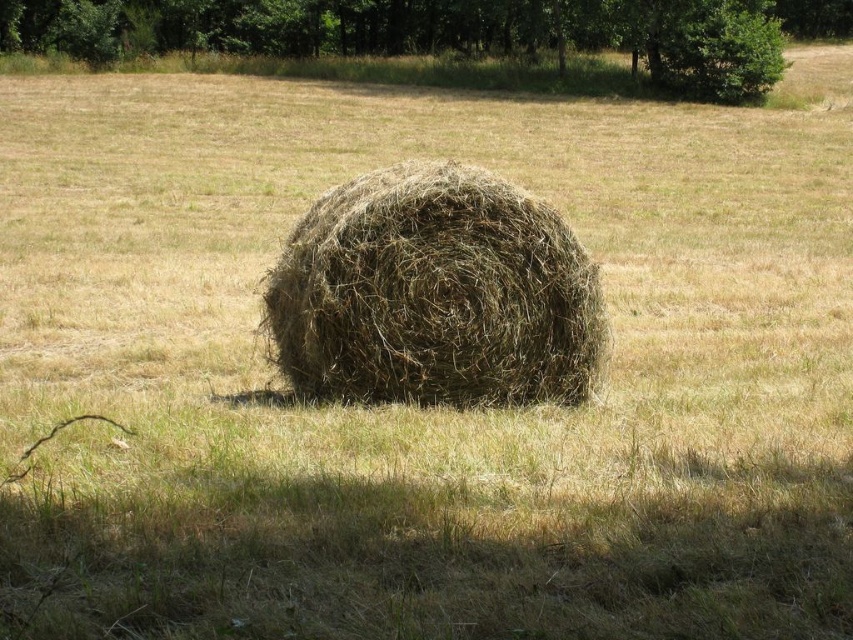
Question: Is brown textured hay at center positioned at the back of green leafy tree at upper center?

Choices:
 (A) no
 (B) yes

Answer: (A)

Question: Which of the following is the farthest from the observer?

Choices:
 (A) (338, 36)
 (B) (334, 244)

Answer: (A)

Question: From the image, what is the correct spatial relationship of brown textured hay at center in relation to green leafy tree at upper center?

Choices:
 (A) above
 (B) below

Answer: (B)

Question: Among these objects, which one is nearest to the camera?

Choices:
 (A) brown textured hay at center
 (B) green leafy tree at upper center

Answer: (A)

Question: Can you confirm if brown textured hay at center is positioned above green leafy tree at upper center?

Choices:
 (A) no
 (B) yes

Answer: (A)